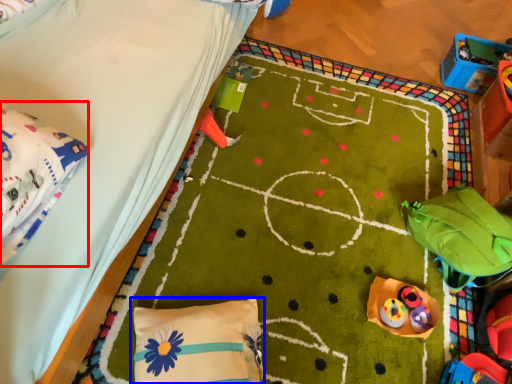
Question: Which point is closer to the camera, material (highlighted by a red box) or pillow (highlighted by a blue box)?

Choices:
 (A) material
 (B) pillow

Answer: (A)